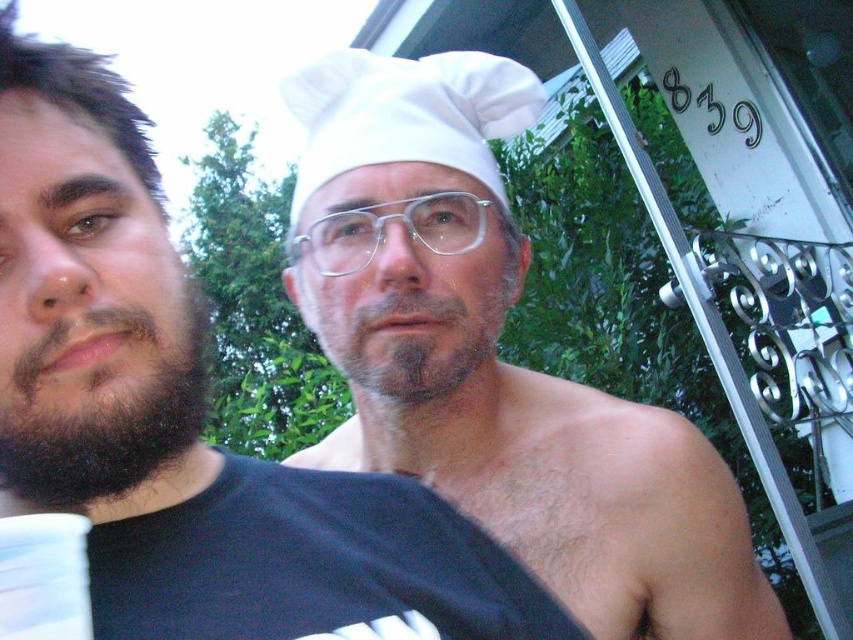
Question: Which object appears closest to the camera in this image?

Choices:
 (A) white fabric chef hat at center
 (B) dark brown hair at left

Answer: (B)

Question: Can you confirm if white fabric chef hat at center is positioned to the right of white fabric chef's hat at center?

Choices:
 (A) no
 (B) yes

Answer: (B)

Question: Where is white fabric chef hat at center located in relation to gray matte beard at center in the image?

Choices:
 (A) below
 (B) above

Answer: (A)

Question: Which object appears farthest from the camera in this image?

Choices:
 (A) white matte chef hat at center
 (B) dark brown hair at left

Answer: (A)

Question: Does dark brown hair at left have a lesser width compared to dark brown fuzzy beard at left?

Choices:
 (A) yes
 (B) no

Answer: (B)

Question: Which object is closer to the camera taking this photo?

Choices:
 (A) gray matte beard at center
 (B) white fabric chef hat at center
 (C) white matte chef hat at center

Answer: (C)